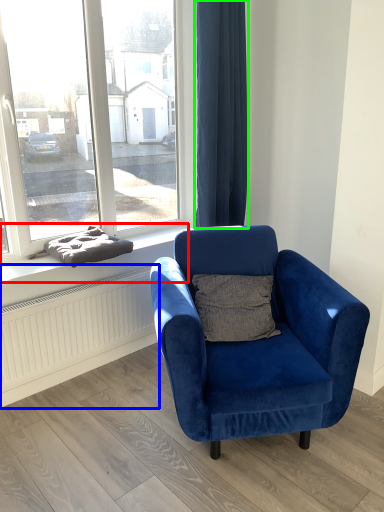
Question: Estimate the real-world distances between objects in this image. Which object is closer to window sill (highlighted by a red box), radiator (highlighted by a blue box) or curtain (highlighted by a green box)?

Choices:
 (A) radiator
 (B) curtain

Answer: (A)